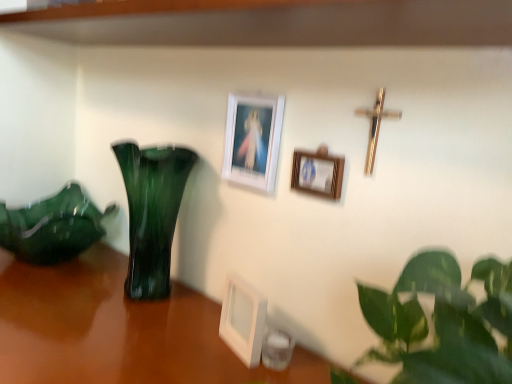
Measure the distance between wooden picture frame at center, which is the second picture frame from bottom to top, and camera.

wooden picture frame at center, which is the second picture frame from bottom to top, is 69.60 centimeters away from camera.

What are the coordinates of `wooden picture frame at center, which is the second picture frame from bottom to top` in the screenshot? It's located at (317, 174).

The image size is (512, 384). Describe the element at coordinates (253, 139) in the screenshot. I see `white matte picture frame at upper center, which appears as the 3th picture frame when ordered from the bottom` at that location.

Describe the element at coordinates (52, 227) in the screenshot. I see `green glass vase at left` at that location.

Image resolution: width=512 pixels, height=384 pixels. What do you see at coordinates (152, 213) in the screenshot?
I see `green glass vase at left` at bounding box center [152, 213].

Identify the location of white plastic picture frame at center, the 1th picture frame ordered from the bottom. This screenshot has height=384, width=512. (243, 320).

Identify the location of wooden picture frame at center, which is the second picture frame from bottom to top. (317, 174).

Considering the sizes of objects gold metallic crucifix at upper right and green glass vase at left in the image provided, who is smaller, gold metallic crucifix at upper right or green glass vase at left?

gold metallic crucifix at upper right.

Is gold metallic crucifix at upper right wider than green glass vase at left?

Incorrect, the width of gold metallic crucifix at upper right does not surpass that of green glass vase at left.

From a real-world perspective, between gold metallic crucifix at upper right and green glass vase at left, who is vertically lower?

green glass vase at left is physically lower.

Looking at this image, can green glass vase at left be found inside gold metallic crucifix at upper right?

Actually, green glass vase at left is outside gold metallic crucifix at upper right.

Which of these two, green glass vase at left or wooden picture frame at center, the second picture frame viewed from the top, is wider?

Wider between the two is green glass vase at left.

Which object is more forward, green glass vase at left or wooden picture frame at center, which is the second picture frame from bottom to top?

wooden picture frame at center, which is the second picture frame from bottom to top, is more forward.

Based on the photo, can you confirm if green glass vase at left is shorter than wooden picture frame at center, which is the second picture frame from bottom to top?

No, green glass vase at left is not shorter than wooden picture frame at center, which is the second picture frame from bottom to top.

Could you tell me if green glass vase at left is turned towards wooden picture frame at center, which is the second picture frame from bottom to top?

No.

In terms of width, does wooden picture frame at center, which is the second picture frame from bottom to top, look wider or thinner when compared to white matte picture frame at upper center, which appears as the 3th picture frame when ordered from the bottom?

wooden picture frame at center, which is the second picture frame from bottom to top, is thinner than white matte picture frame at upper center, which appears as the 3th picture frame when ordered from the bottom.

Considering the positions of objects wooden picture frame at center, which is the second picture frame from bottom to top, and white matte picture frame at upper center, which appears as the 3th picture frame when ordered from the bottom, in the image provided, who is more to the left, wooden picture frame at center, which is the second picture frame from bottom to top, or white matte picture frame at upper center, which appears as the 3th picture frame when ordered from the bottom,?

white matte picture frame at upper center, which appears as the 3th picture frame when ordered from the bottom, is more to the left.

From their relative heights in the image, would you say wooden picture frame at center, the second picture frame viewed from the top, is taller or shorter than white matte picture frame at upper center, which appears as the 3th picture frame when ordered from the bottom?

In the image, wooden picture frame at center, the second picture frame viewed from the top, appears to be shorter than white matte picture frame at upper center, which appears as the 3th picture frame when ordered from the bottom.

Considering the points (340, 188) and (254, 97), which point is behind, point (340, 188) or point (254, 97)?

Positioned behind is point (254, 97).

Is white plastic picture frame at center, the 1th picture frame ordered from the bottom, situated inside wooden picture frame at center, which is the second picture frame from bottom to top, or outside?

white plastic picture frame at center, the 1th picture frame ordered from the bottom, is outside wooden picture frame at center, which is the second picture frame from bottom to top.

In the scene shown: Considering the relative sizes of white plastic picture frame at center, placed as the third picture frame when sorted from top to bottom, and wooden picture frame at center, the second picture frame viewed from the top, in the image provided, is white plastic picture frame at center, placed as the third picture frame when sorted from top to bottom, taller than wooden picture frame at center, the second picture frame viewed from the top,?

Answer: Indeed, white plastic picture frame at center, placed as the third picture frame when sorted from top to bottom, has a greater height compared to wooden picture frame at center, the second picture frame viewed from the top.

Is point (244, 306) closer or farther from the camera than point (293, 158)?

Point (244, 306) appears to be closer to the viewer than point (293, 158).

Is green glass vase at left positioned with its back to white plastic picture frame at center, placed as the third picture frame when sorted from top to bottom?

That's not correct — green glass vase at left is not looking away from white plastic picture frame at center, placed as the third picture frame when sorted from top to bottom.

From a real-world perspective, is green glass vase at left physically located above or below white plastic picture frame at center, placed as the third picture frame when sorted from top to bottom?

In terms of real-world spatial position, green glass vase at left is above white plastic picture frame at center, placed as the third picture frame when sorted from top to bottom.

Is green glass vase at left inside the boundaries of white plastic picture frame at center, placed as the third picture frame when sorted from top to bottom, or outside?

green glass vase at left exists outside the volume of white plastic picture frame at center, placed as the third picture frame when sorted from top to bottom.

At what (x,y) coordinates should I click in order to perform the action: click on vase above the green glass vase at left (from the image's perspective). Please return your answer as a coordinate pair (x, y). Looking at the image, I should click on (152, 213).

From the picture: Is green glass vase at left completely or partially outside of green glass vase at left?

green glass vase at left is positioned outside green glass vase at left.

Is point (170, 205) in front of point (4, 246)?

Yes, it is.

From the image's perspective, between green glass vase at left and green glass vase at left, which one is located above?

green glass vase at left is shown above in the image.

Who is shorter, green glass vase at left or gold metallic crucifix at upper right?

Standing shorter between the two is gold metallic crucifix at upper right.

Is gold metallic crucifix at upper right located within green glass vase at left?

No, gold metallic crucifix at upper right is located outside of green glass vase at left.

The width and height of the screenshot is (512, 384). I want to click on crucifix on the right side of green glass vase at left, so click(x=375, y=126).

Where is `houseplant below the wooden picture frame at center, the second picture frame viewed from the top (from a real-world perspective)`? The height and width of the screenshot is (384, 512). houseplant below the wooden picture frame at center, the second picture frame viewed from the top (from a real-world perspective) is located at coordinates (52, 227).

Which object lies further to the anchor point gold metallic crucifix at upper right, wooden picture frame at center, which is the second picture frame from bottom to top, or green glass vase at left?

The object further to gold metallic crucifix at upper right is green glass vase at left.

Which object lies nearer to the anchor point gold metallic crucifix at upper right, green glass vase at left or white matte picture frame at upper center, which appears as the 3th picture frame when ordered from the bottom?

The object closer to gold metallic crucifix at upper right is white matte picture frame at upper center, which appears as the 3th picture frame when ordered from the bottom.

Estimate the real-world distances between objects in this image. Which object is closer to white matte picture frame at upper center, arranged as the first picture frame when viewed from the top, gold metallic crucifix at upper right or green glass vase at left?

green glass vase at left.

Based on the photo, based on their spatial positions, is green glass vase at left or green glass vase at left further from wooden picture frame at center, which is the second picture frame from bottom to top?

Based on the image, green glass vase at left appears to be further to wooden picture frame at center, which is the second picture frame from bottom to top.

Based on their spatial positions, is green glass vase at left or wooden picture frame at center, the second picture frame viewed from the top, closer to green glass vase at left?

green glass vase at left is positioned closer to the anchor green glass vase at left.

When comparing their distances from white plastic picture frame at center, the 1th picture frame ordered from the bottom, does gold metallic crucifix at upper right or green glass vase at left seem further?

green glass vase at left is positioned further to the anchor white plastic picture frame at center, the 1th picture frame ordered from the bottom.

Looking at the image, which one is located closer to white matte picture frame at upper center, arranged as the first picture frame when viewed from the top, wooden picture frame at center, which is the second picture frame from bottom to top, or white plastic picture frame at center, placed as the third picture frame when sorted from top to bottom?

wooden picture frame at center, which is the second picture frame from bottom to top.

Which object lies further to the anchor point white plastic picture frame at center, placed as the third picture frame when sorted from top to bottom, wooden picture frame at center, which is the second picture frame from bottom to top, or gold metallic crucifix at upper right?

gold metallic crucifix at upper right is positioned further to the anchor white plastic picture frame at center, placed as the third picture frame when sorted from top to bottom.

Find the location of `crucifix between white matte picture frame at upper center, which appears as the 3th picture frame when ordered from the bottom, and white plastic picture frame at center, the 1th picture frame ordered from the bottom, from top to bottom`. crucifix between white matte picture frame at upper center, which appears as the 3th picture frame when ordered from the bottom, and white plastic picture frame at center, the 1th picture frame ordered from the bottom, from top to bottom is located at coordinates (375, 126).

What are the coordinates of `picture frame between white matte picture frame at upper center, which appears as the 3th picture frame when ordered from the bottom, and white plastic picture frame at center, placed as the third picture frame when sorted from top to bottom, from top to bottom` in the screenshot? It's located at (317, 174).

At what (x,y) coordinates should I click in order to perform the action: click on picture frame between gold metallic crucifix at upper right and white plastic picture frame at center, placed as the third picture frame when sorted from top to bottom, vertically. Please return your answer as a coordinate pair (x, y). The height and width of the screenshot is (384, 512). Looking at the image, I should click on pyautogui.click(x=317, y=174).

Where is `vase between green glass vase at left and white matte picture frame at upper center, arranged as the first picture frame when viewed from the top, in the horizontal direction`? Image resolution: width=512 pixels, height=384 pixels. vase between green glass vase at left and white matte picture frame at upper center, arranged as the first picture frame when viewed from the top, in the horizontal direction is located at coordinates (152, 213).